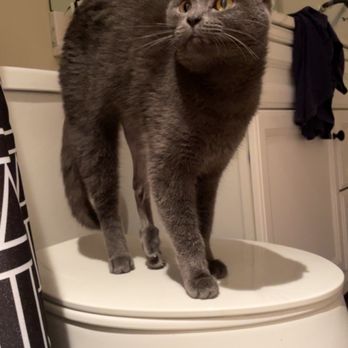
Find the location of a particular element. towel is located at coordinates (316, 47).